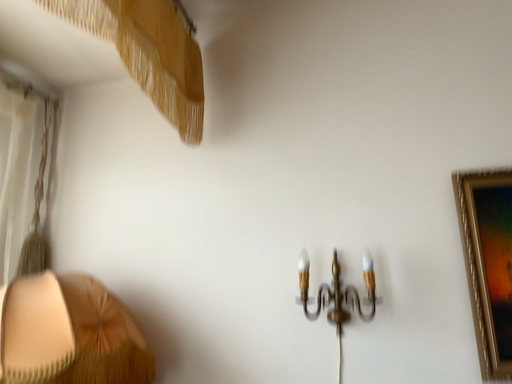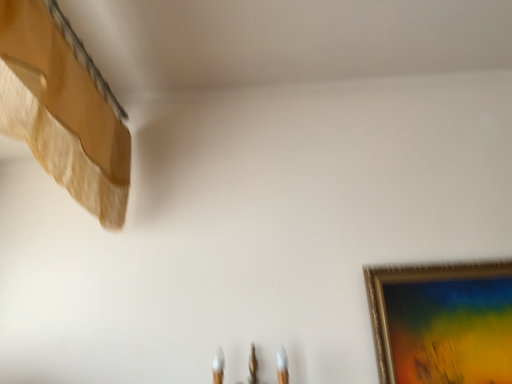
Question: Which way did the camera rotate in the video?

Choices:
 (A) rotated downward
 (B) rotated upward

Answer: (B)